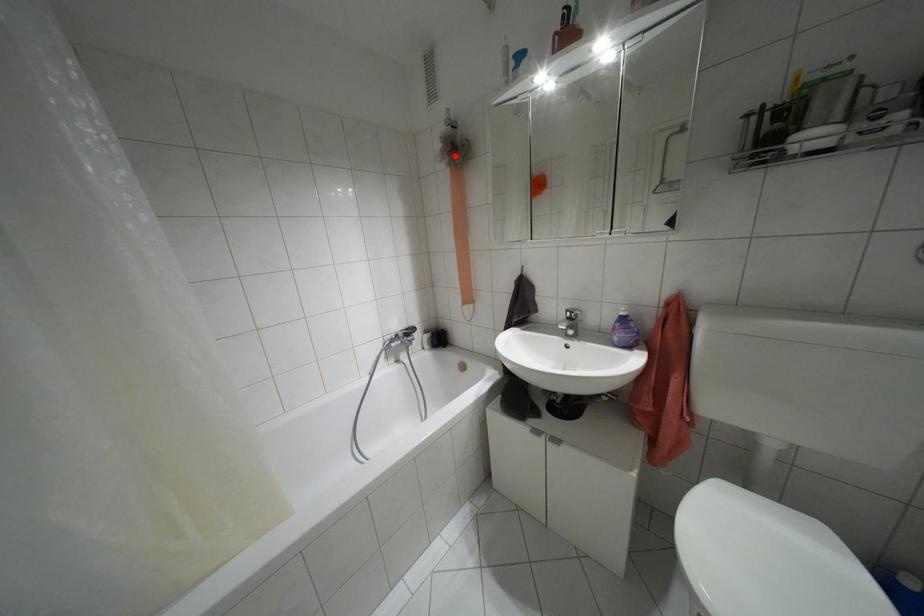
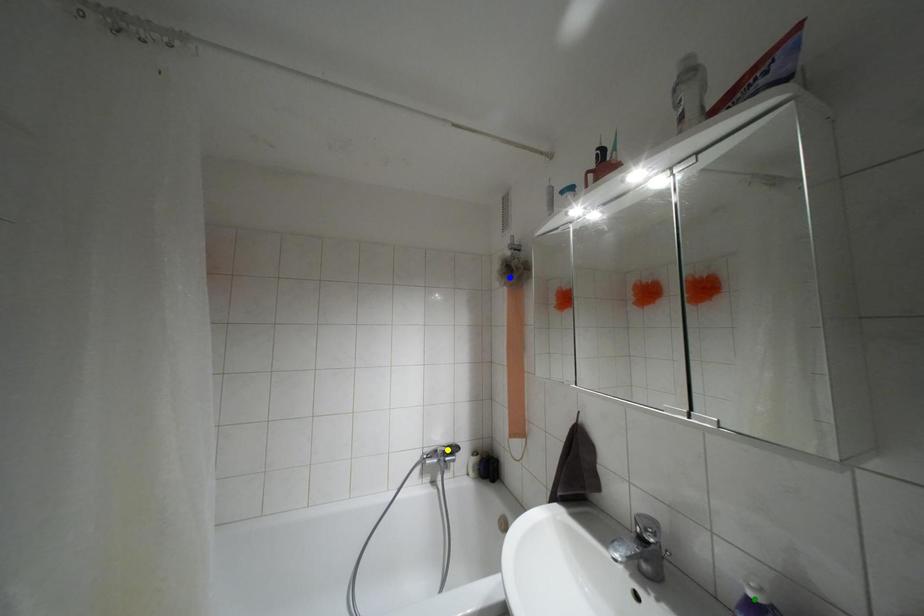
Question: I am providing you with two images of the same scene from different viewpoints. A red point is marked on the first image. You are given multiple points on the second image. Which point in image 2 represents the same 3d spot as the red point in image 1?

Choices:
 (A) green point
 (B) blue point
 (C) yellow point

Answer: (B)